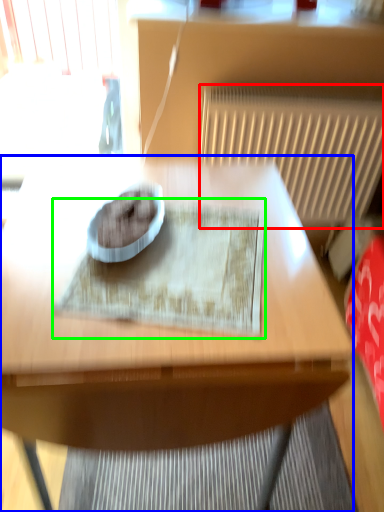
Question: Estimate the real-world distances between objects in this image. Which object is closer to radiator (highlighted by a red box), table (highlighted by a blue box) or mat (highlighted by a green box)?

Choices:
 (A) table
 (B) mat

Answer: (A)